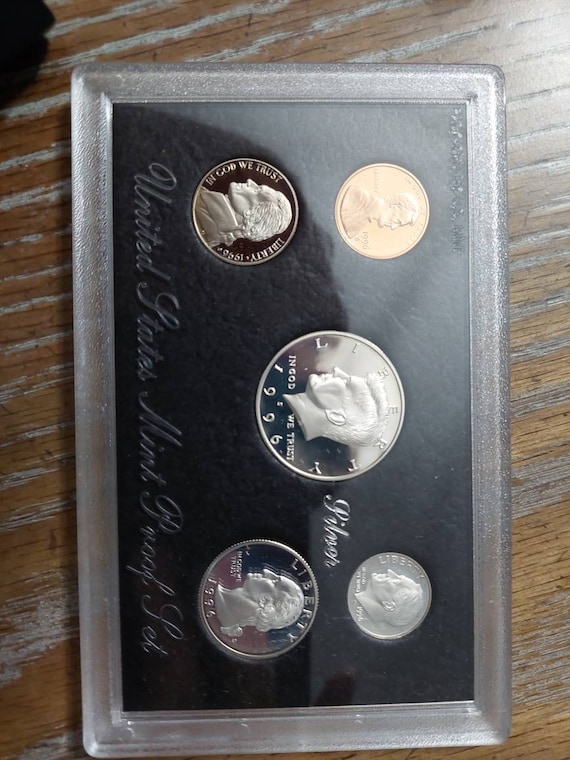
Find the location of a particular element. This screenshot has height=760, width=570. frame of display case is located at coordinates (101, 451).